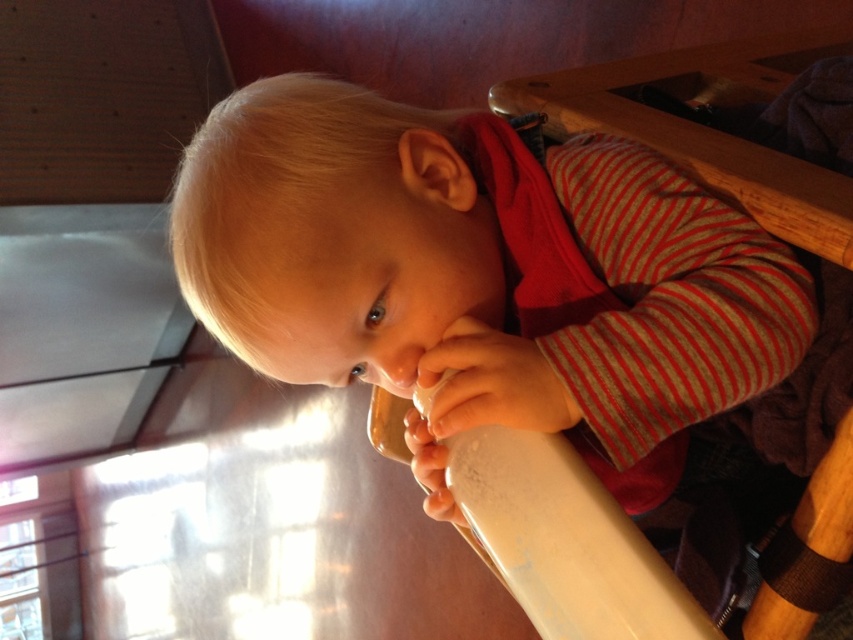
Question: Considering the real-world distances, which object is farthest from the white matte hand at lower center?

Choices:
 (A) smooth white hand at center
 (B) white plastic cup at center

Answer: (B)

Question: Which point is farther to the camera?

Choices:
 (A) (x=589, y=182)
 (B) (x=418, y=465)

Answer: (A)

Question: Among these objects, which one is farthest from the camera?

Choices:
 (A) white matte hand at lower center
 (B) smooth white hand at center
 (C) white plastic cup at center

Answer: (A)

Question: Is white plastic cup at center below smooth white hand at center?

Choices:
 (A) no
 (B) yes

Answer: (A)

Question: Observing the image, what is the correct spatial positioning of smooth white hand at center in reference to white matte hand at lower center?

Choices:
 (A) above
 (B) below

Answer: (A)

Question: Does white plastic cup at center appear on the right side of smooth white hand at center?

Choices:
 (A) no
 (B) yes

Answer: (B)